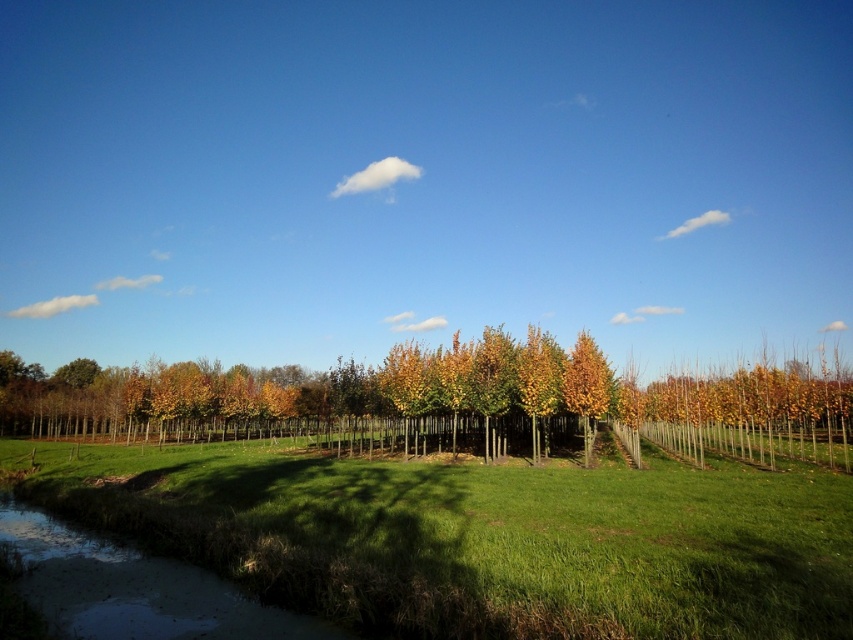
Question: Which point is closer to the camera?

Choices:
 (A) green grass at center
 (B) golden yellow leaves at center

Answer: (A)

Question: Can you confirm if green grass at center is wider than golden yellow leaves at center?

Choices:
 (A) no
 (B) yes

Answer: (B)

Question: Does green grass at center have a greater width compared to golden yellow leaves at center?

Choices:
 (A) no
 (B) yes

Answer: (B)

Question: Can you confirm if green grass at center is positioned below golden yellow leaves at center?

Choices:
 (A) yes
 (B) no

Answer: (B)

Question: Which point is farther to the camera?

Choices:
 (A) green grass at center
 (B) golden yellow leaves at center

Answer: (B)